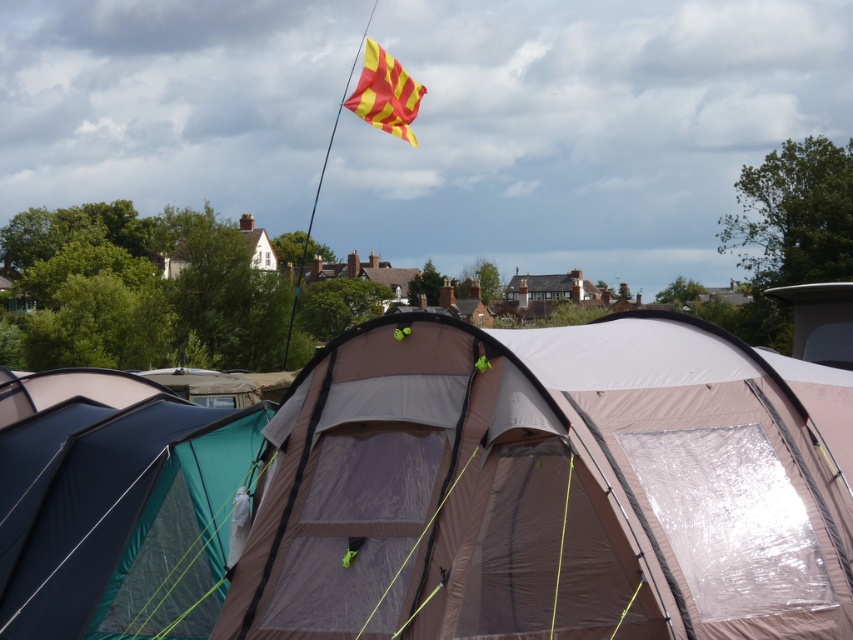
You are planning to set up a new tent in the camping area. The matte brown tent at center is already occupied. Can you fit another teal fabric tent at lower left next to it without overlapping?

The matte brown tent at center is larger in size than the teal fabric tent at lower left, so there should be enough space to place the teal fabric tent at lower left next to it without overlapping.

Looking at this image, you are a hiker who has just arrived at the campsite. You see a point marked at coordinates (549, 488). Which object does this point correspond to?

The point corresponds to the matte brown tent at center.

You are a camper who wants to set up a new tent between the teal fabric tent at lower left and the beige tent with dark gray roof. The new tent requires 3 meters of space between each existing tent. Is there enough space to set it up?

The distance between the teal fabric tent at lower left and the beige tent with dark gray roof is 7.60 meters. Since the new tent needs 3 meters of space between each existing tent, the total required space would be 3 meters before the new tent and 3 meters after, totaling 6 meters. Since 7.60 meters is greater than 6 meters, there is enough space to set it up.